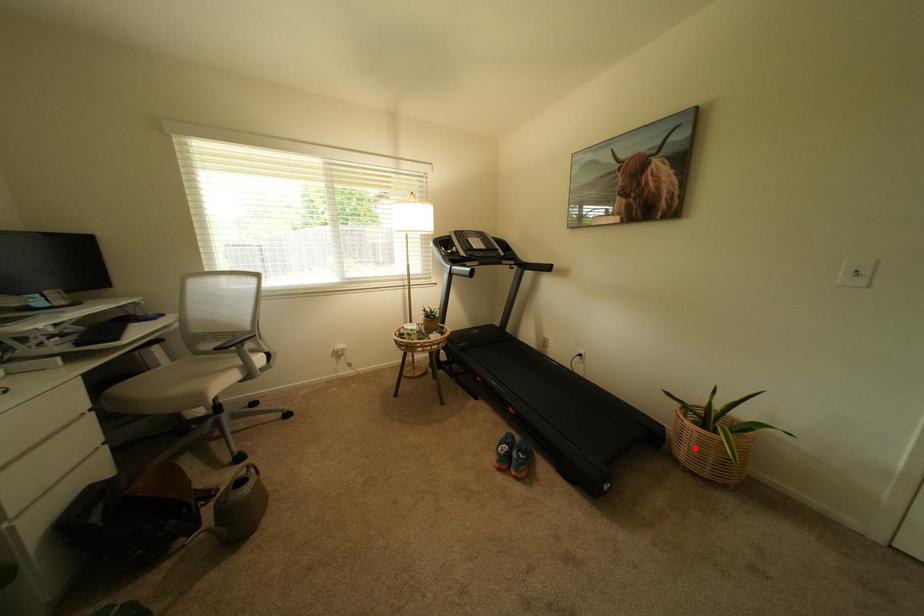
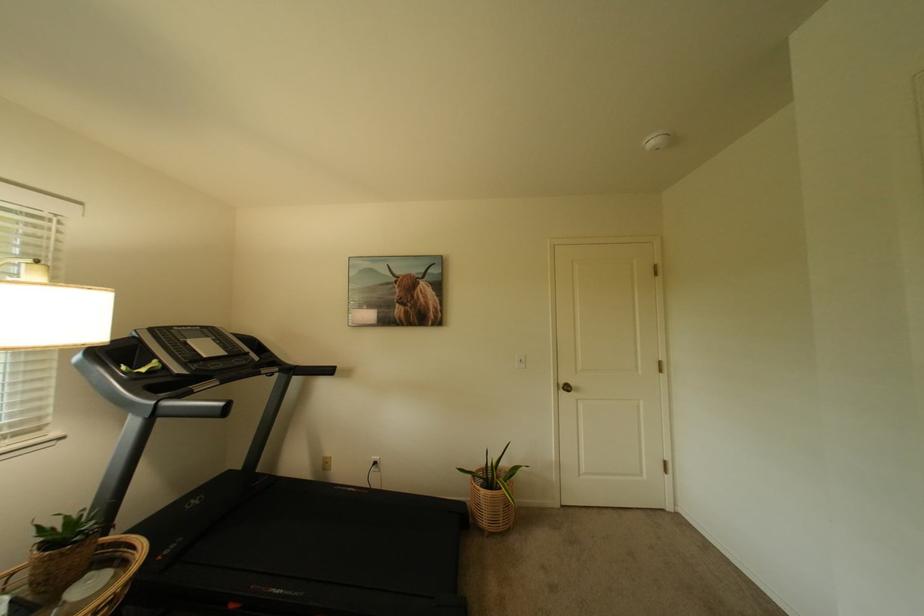
In the second image, find the point that corresponds to the highlighted location in the first image.

(495, 515)